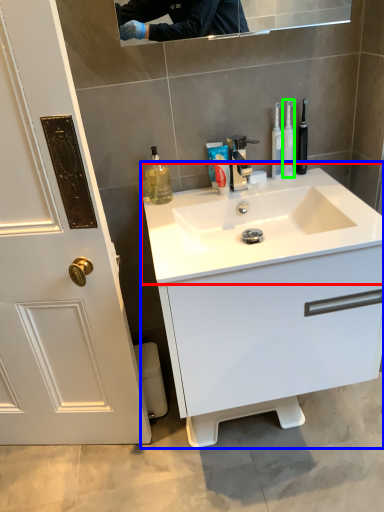
Question: Based on their relative distances, which object is farther from sink (highlighted by a red box)? Choose from bathroom cabinet (highlighted by a blue box) and toothbrush (highlighted by a green box).

Choices:
 (A) bathroom cabinet
 (B) toothbrush

Answer: (B)